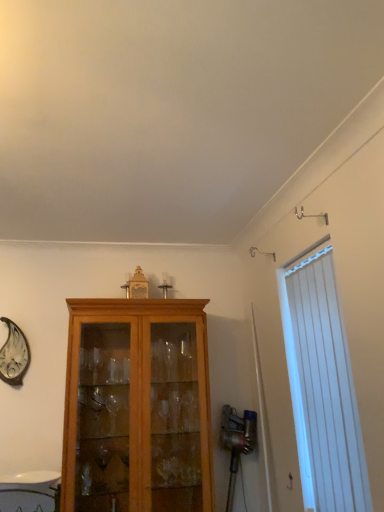
Image resolution: width=384 pixels, height=512 pixels. What do you see at coordinates (322, 385) in the screenshot? I see `white vertical blinds at right` at bounding box center [322, 385].

Where is `white vertical blinds at right`? The height and width of the screenshot is (512, 384). white vertical blinds at right is located at coordinates (322, 385).

This screenshot has height=512, width=384. What do you see at coordinates (137, 405) in the screenshot?
I see `light brown wood cabinet at center` at bounding box center [137, 405].

I want to click on light brown wood cabinet at center, so coord(137,405).

I want to click on white vertical blinds at right, so click(x=322, y=385).

Which object is positioned more to the left, light brown wood cabinet at center or white vertical blinds at right?

From the viewer's perspective, light brown wood cabinet at center appears more on the left side.

Relative to white vertical blinds at right, is light brown wood cabinet at center in front or behind?

Clearly, light brown wood cabinet at center is behind white vertical blinds at right.

Considering the positions of point (148, 356) and point (354, 467), is point (148, 356) closer or farther from the camera than point (354, 467)?

Point (148, 356) is positioned farther from the camera compared to point (354, 467).

From the image's perspective, which one is positioned lower, light brown wood cabinet at center or white vertical blinds at right?

From the image's view, light brown wood cabinet at center is below.

From a real-world perspective, between light brown wood cabinet at center and white vertical blinds at right, who is vertically higher?

white vertical blinds at right is physically above.

Does light brown wood cabinet at center have a greater width compared to white vertical blinds at right?

Yes.

In the scene shown: From their relative heights in the image, would you say light brown wood cabinet at center is taller or shorter than white vertical blinds at right?

Clearly, light brown wood cabinet at center is taller compared to white vertical blinds at right.

Considering the relative sizes of light brown wood cabinet at center and white vertical blinds at right in the image provided, is light brown wood cabinet at center bigger than white vertical blinds at right?

Correct, light brown wood cabinet at center is larger in size than white vertical blinds at right.

Would you say light brown wood cabinet at center contains white vertical blinds at right?

That's incorrect, white vertical blinds at right is not inside light brown wood cabinet at center.

Are light brown wood cabinet at center and white vertical blinds at right beside each other?

light brown wood cabinet at center and white vertical blinds at right are clearly separated.

Is light brown wood cabinet at center positioned with its back to white vertical blinds at right?

light brown wood cabinet at center is not turned away from white vertical blinds at right.

The image size is (384, 512). In order to click on window in front of the light brown wood cabinet at center in this screenshot , I will do `click(322, 385)`.

Visually, is white vertical blinds at right positioned to the left or to the right of light brown wood cabinet at center?

white vertical blinds at right is positioned on light brown wood cabinet at center's right side.

Considering the relative positions of white vertical blinds at right and light brown wood cabinet at center in the image provided, is white vertical blinds at right behind light brown wood cabinet at center?

No, the depth of white vertical blinds at right is less than that of light brown wood cabinet at center.

Is point (319, 350) closer or farther from the camera than point (98, 469)?

Clearly, point (319, 350) is closer to the camera than point (98, 469).

From the image's perspective, between white vertical blinds at right and light brown wood cabinet at center, which one is located above?

white vertical blinds at right appears higher in the image.

From a real-world perspective, which object rests below the other?

In real-world perspective, light brown wood cabinet at center is lower.

Is white vertical blinds at right wider than light brown wood cabinet at center?

In fact, white vertical blinds at right might be narrower than light brown wood cabinet at center.

Can you confirm if white vertical blinds at right is taller than light brown wood cabinet at center?

No, white vertical blinds at right is not taller than light brown wood cabinet at center.

Considering the relative sizes of white vertical blinds at right and light brown wood cabinet at center in the image provided, is white vertical blinds at right bigger than light brown wood cabinet at center?

Actually, white vertical blinds at right might be smaller than light brown wood cabinet at center.

Choose the correct answer: Is white vertical blinds at right inside light brown wood cabinet at center or outside it?

The correct answer is: outside.

Would you consider white vertical blinds at right to be distant from light brown wood cabinet at center?

white vertical blinds at right is near light brown wood cabinet at center, not far away.

Could you tell me if white vertical blinds at right is facing light brown wood cabinet at center?

No, white vertical blinds at right is not aimed at light brown wood cabinet at center.

How distant is white vertical blinds at right from light brown wood cabinet at center?

33.00 inches.

What are the coordinates of `window lying above the light brown wood cabinet at center (from the image's perspective)` in the screenshot? It's located at (322, 385).

The width and height of the screenshot is (384, 512). What are the coordinates of `window on the right of light brown wood cabinet at center` in the screenshot? It's located at (322, 385).

Identify the location of cupboard below the white vertical blinds at right (from a real-world perspective). The width and height of the screenshot is (384, 512). coord(137,405).